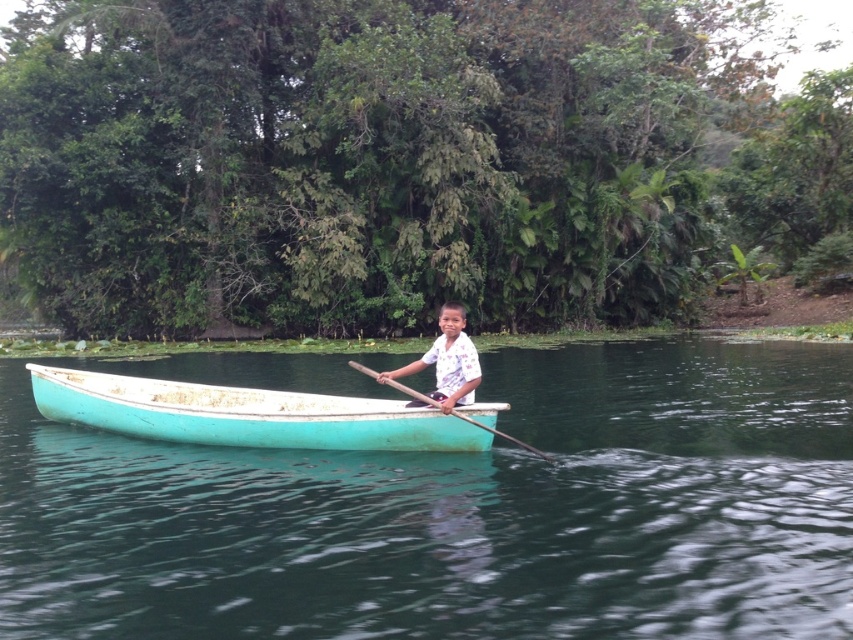
Question: Observing the image, what is the correct spatial positioning of teal painted wood boat at center in reference to wooden at center?

Choices:
 (A) above
 (B) below

Answer: (B)

Question: Estimate the real-world distances between objects in this image. Which object is farther from the wooden at center?

Choices:
 (A) teal wooden boat at center
 (B) white printed shirt at center

Answer: (A)

Question: Does teal wooden boat at center appear over teal painted wood boat at center?

Choices:
 (A) no
 (B) yes

Answer: (A)

Question: Which point is closer to the camera taking this photo?

Choices:
 (A) (529, 412)
 (B) (450, 371)
 (C) (291, 444)

Answer: (B)

Question: In this image, where is teal wooden boat at center located relative to teal painted wood boat at center?

Choices:
 (A) right
 (B) left

Answer: (B)

Question: Which object is positioned farthest from the teal painted wood boat at center?

Choices:
 (A) teal wooden boat at center
 (B) wooden at center
 (C) white printed shirt at center

Answer: (A)